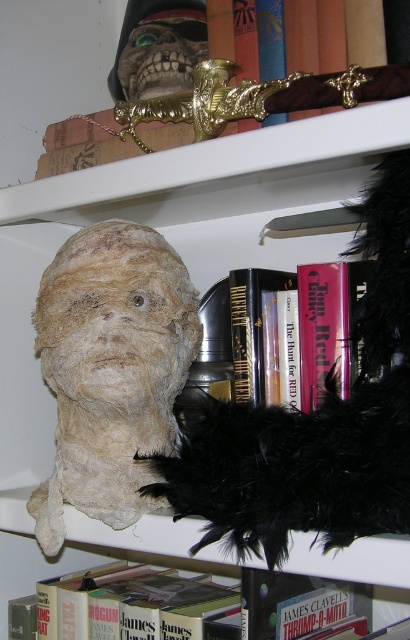
You are organizing a shelf and need to place two hardcover books. The scene shows a hardcover book at center and a hardcover book at lower center. Based on their positions, which book is positioned to the right of the other?

The hardcover book at center is to the right of the hardcover book at lower center.

You are organizing a museum exhibit and need to ensure proper display. The white fabric mummy head at left and the hardcover book at center are part of the collection. Based on their positions, which object is placed lower on the shelf?

The white fabric mummy head at left is located below the hardcover book at center, so it is placed lower on the shelf.